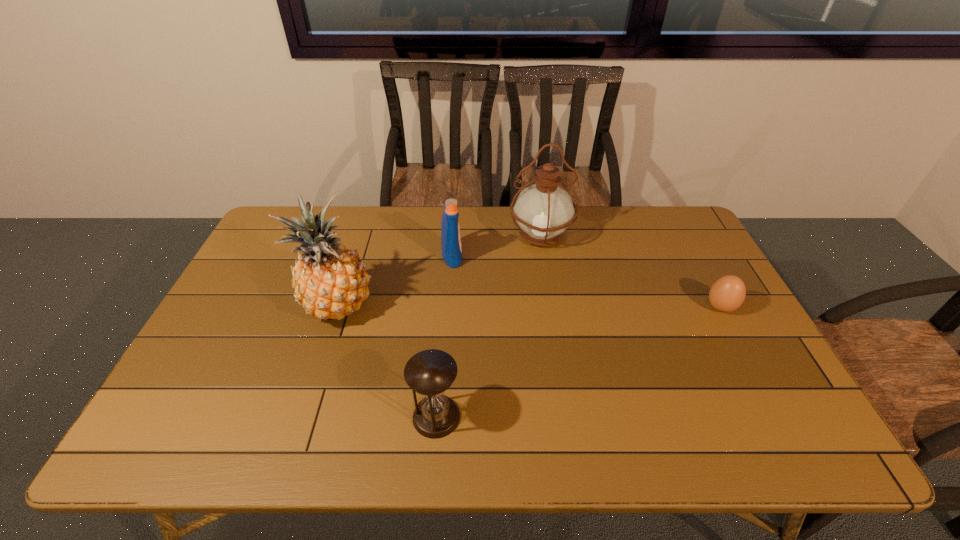
Identify the location of free space at the near right corner. The height and width of the screenshot is (540, 960). (804, 441).

Find the location of a particular element. Image resolution: width=960 pixels, height=540 pixels. empty location between the third tallest object and the pineapple is located at coordinates (395, 281).

Image resolution: width=960 pixels, height=540 pixels. I want to click on empty location between the nearest object and the leftmost object, so click(x=387, y=361).

Where is `vacant space that is in between the third tallest object and the nearest object`? The image size is (960, 540). vacant space that is in between the third tallest object and the nearest object is located at coordinates (444, 336).

Identify the location of free spot between the fourth tallest object and the leftmost object. (387, 361).

This screenshot has height=540, width=960. In order to click on unoccupied position between the second object from right to left and the third shortest object in this screenshot , I will do `click(496, 246)`.

I want to click on vacant region between the leftmost object and the shortest object, so click(528, 307).

I want to click on vacant area that lies between the second shortest object and the third tallest object, so click(x=444, y=336).

Find the location of `free space between the fourth object from left to right and the detergent`. free space between the fourth object from left to right and the detergent is located at coordinates (496, 246).

What are the coordinates of `unoccupied area between the oil lamp and the boiled egg` in the screenshot? It's located at (631, 272).